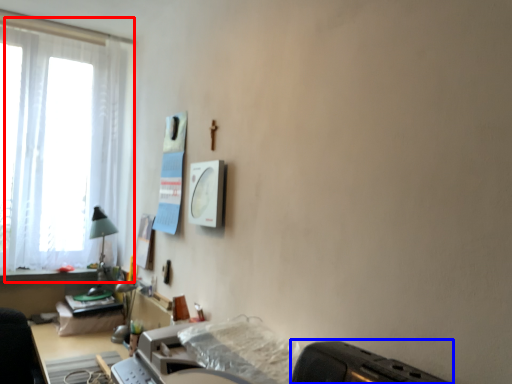
Question: Which object is further to the camera taking this photo, window (highlighted by a red box) or appliance (highlighted by a blue box)?

Choices:
 (A) window
 (B) appliance

Answer: (A)